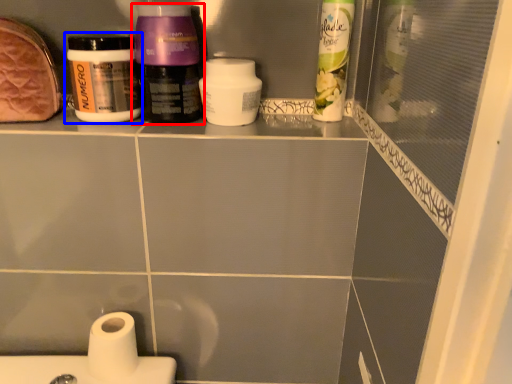
Question: Which object appears farthest to the camera in this image, bottle (highlighted by a red box) or bottle (highlighted by a blue box)?

Choices:
 (A) bottle
 (B) bottle

Answer: (B)